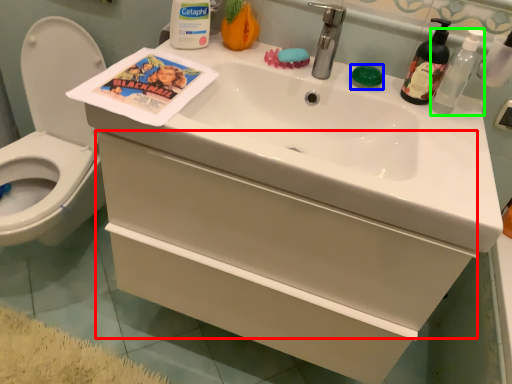
Question: Based on their relative distances, which object is farther from drawer (highlighted by a red box)? Choose from soap (highlighted by a blue box) and bottle (highlighted by a green box).

Choices:
 (A) soap
 (B) bottle

Answer: (B)